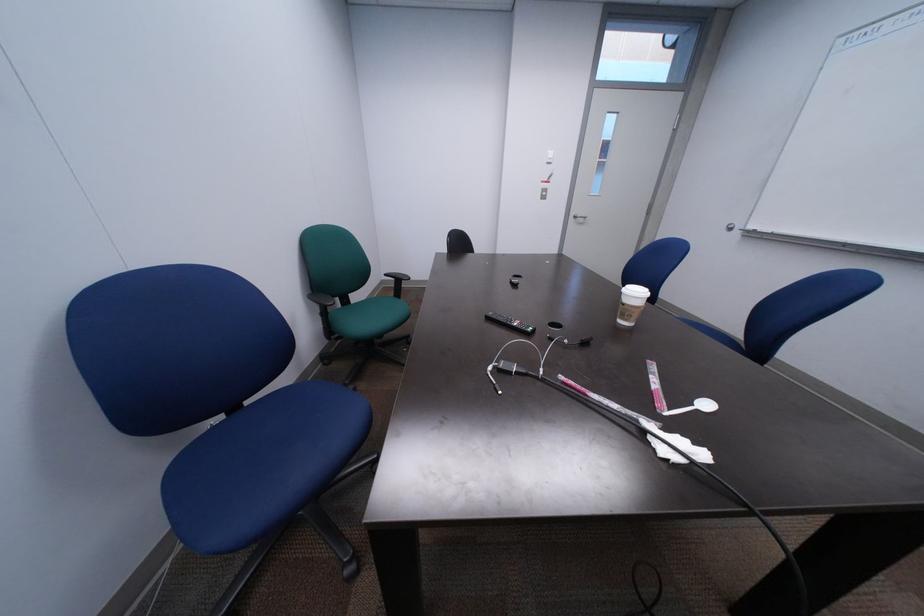
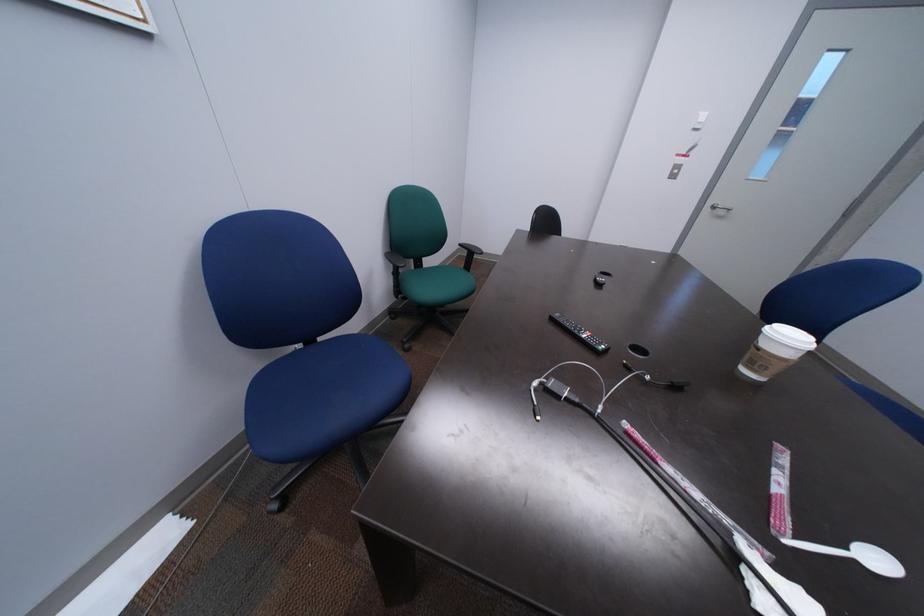
Question: In a continuous first-person perspective shot, in which direction is the camera moving?

Choices:
 (A) Left
 (B) Right
 (C) Forward
 (D) Backward

Answer: (C)